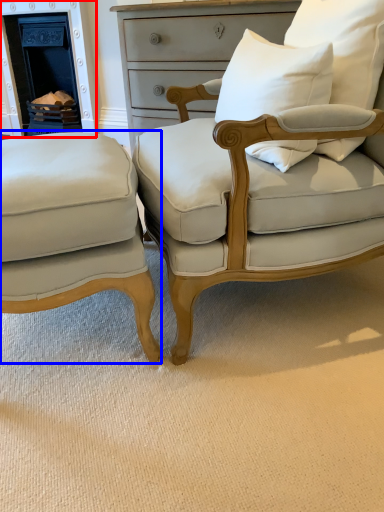
Question: Which object appears farthest to the camera in this image, fireplace (highlighted by a red box) or chair (highlighted by a blue box)?

Choices:
 (A) fireplace
 (B) chair

Answer: (A)